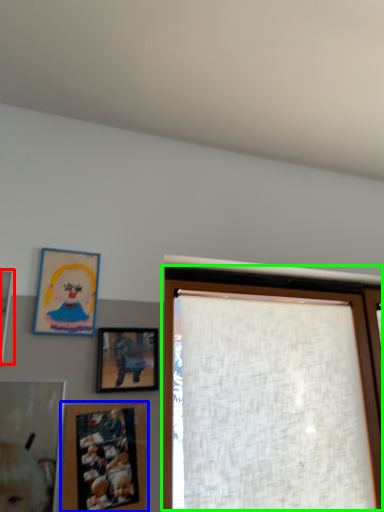
Question: Estimate the real-world distances between objects in this image. Which object is farther from picture frame (highlighted by a red box), picture frame (highlighted by a blue box) or window (highlighted by a green box)?

Choices:
 (A) picture frame
 (B) window

Answer: (B)